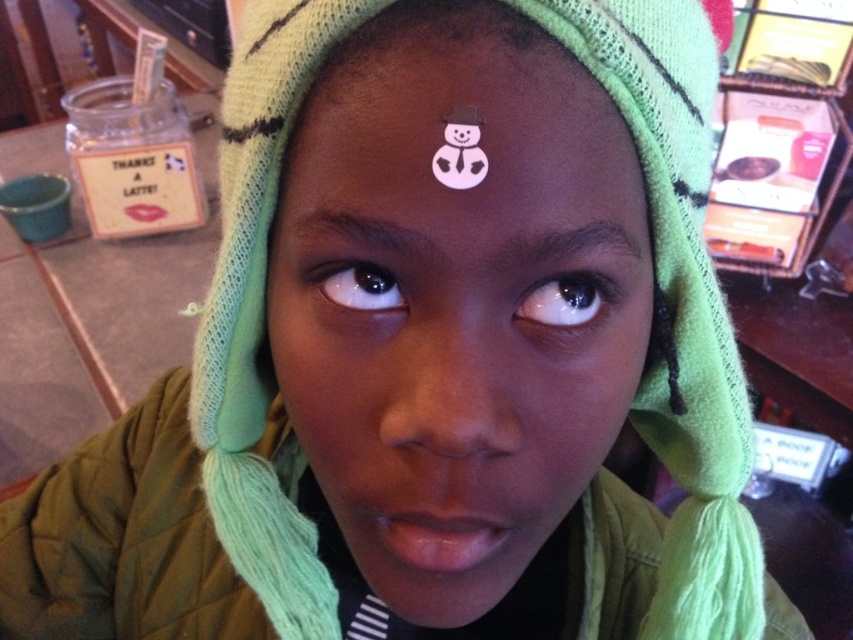
You are a delivery robot in a cafe. You need to deliver a package to the person wearing a bright green knitted hat with black stripes. The package must be placed precisely at the white paper snowman on their forehead. The coordinates for the snowman are point (456, 300). Can you confirm the location of the snowman?

The point (456, 300) corresponds to the white paper snowman at center, so the snowman is located at the center position.

You are designing a greeting card and want to ensure the pink paper snowman at center and the black glossy eye at center are proportionally accurate. Which object should you make larger in your design to maintain the correct size relationship?

The pink paper snowman at center should be made larger than the black glossy eye at center to maintain the correct size relationship since the pink paper snowman at center is wider in the original image.

You are a barista in a cozy coffee shop. You notice a customer wearing a hat with a white paper snowman at center and a brown matte eye at center. The customer wants to know if the snowman is above or below the eye. What do you tell them?

The white paper snowman at center is positioned under the brown matte eye at center, so the snowman is below the eye.